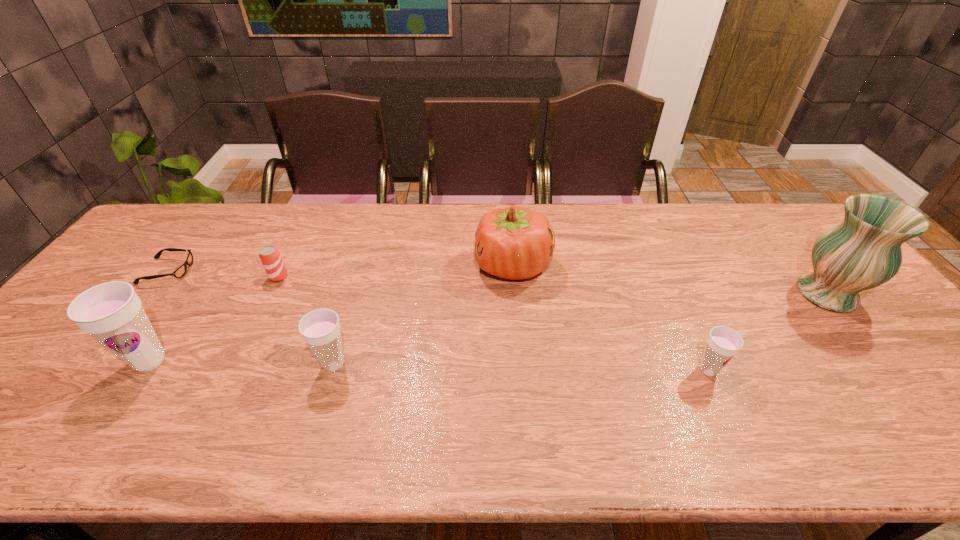
Point out which cup is positioned as the nearest to the tallest cup. Please provide its 2D coordinates. Your answer should be formatted as a tuple, i.e. [(x, y)], where the tuple contains the x and y coordinates of a point satisfying the conditions above.

[(320, 328)]

The height and width of the screenshot is (540, 960). In order to click on vacant space that satisfies the following two spatial constraints: 1. on the back side of the fifth object from right to left; 2. on the front-facing side of the shortest object in this screenshot , I will do `click(281, 271)`.

Find the location of `free space that satisfies the following two spatial constraints: 1. on the front-facing side of the second shortest object; 2. on the left side of the spectacles`. free space that satisfies the following two spatial constraints: 1. on the front-facing side of the second shortest object; 2. on the left side of the spectacles is located at coordinates (163, 277).

I want to click on free location that satisfies the following two spatial constraints: 1. on the front-facing side of the shortest object; 2. on the back side of the fifth tallest object, so click(91, 370).

Where is `vacant space that satisfies the following two spatial constraints: 1. on the side of the fifth object from left to right with the cute face; 2. on the back side of the vase`? This screenshot has height=540, width=960. vacant space that satisfies the following two spatial constraints: 1. on the side of the fifth object from left to right with the cute face; 2. on the back side of the vase is located at coordinates (516, 294).

At what (x,y) coordinates should I click in order to perform the action: click on free space that satisfies the following two spatial constraints: 1. on the front-facing side of the tallest cup; 2. on the left side of the spectacles. Please return your answer as a coordinate pair (x, y). Looking at the image, I should click on (99, 361).